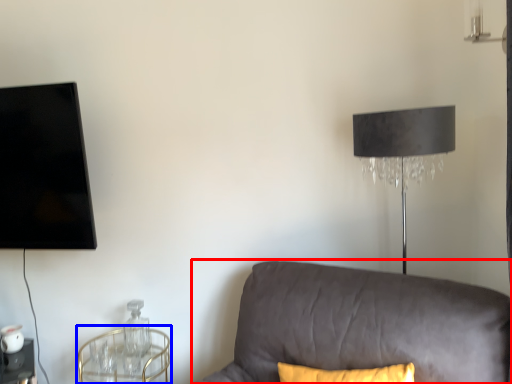
Question: Which object is further to the camera taking this photo, studio couch (highlighted by a red box) or round table (highlighted by a blue box)?

Choices:
 (A) studio couch
 (B) round table

Answer: (B)